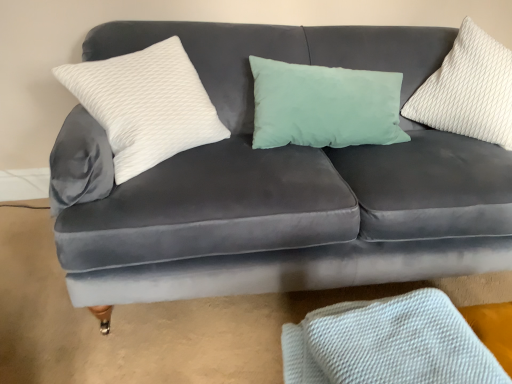
Question: Should I look upward or downward to see white textured fabric at lower right?

Choices:
 (A) down
 (B) up

Answer: (A)

Question: Can you confirm if white textured fabric at lower right is taller than white textured pillow at upper right, the first pillow from the right?

Choices:
 (A) no
 (B) yes

Answer: (A)

Question: Would you say white textured fabric at lower right is outside white textured pillow at upper right, the first pillow from the right?

Choices:
 (A) yes
 (B) no

Answer: (A)

Question: Can you confirm if white textured fabric at lower right is smaller than white textured pillow at upper right, the first pillow from the right?

Choices:
 (A) yes
 (B) no

Answer: (A)

Question: Can you confirm if white textured fabric at lower right is bigger than white textured pillow at upper right, the second pillow from the left?

Choices:
 (A) no
 (B) yes

Answer: (A)

Question: Is white textured fabric at lower right to the right of white textured pillow at upper right, the first pillow from the right, from the viewer's perspective?

Choices:
 (A) yes
 (B) no

Answer: (B)

Question: Is the depth of white textured fabric at lower right less than that of white textured pillow at upper right, the second pillow from the left?

Choices:
 (A) yes
 (B) no

Answer: (A)

Question: Is white textured fabric at lower right surrounded by white textured pillow at left, the 2th pillow positioned from the right?

Choices:
 (A) yes
 (B) no

Answer: (B)

Question: Is white textured pillow at left, the 1th pillow positioned from the left, thinner than white textured fabric at lower right?

Choices:
 (A) no
 (B) yes

Answer: (B)

Question: Would you consider white textured pillow at left, the 1th pillow positioned from the left, to be distant from white textured fabric at lower right?

Choices:
 (A) no
 (B) yes

Answer: (A)

Question: From a real-world perspective, is white textured pillow at left, the 2th pillow positioned from the right, on white textured fabric at lower right?

Choices:
 (A) yes
 (B) no

Answer: (A)

Question: Is white textured pillow at left, the 1th pillow positioned from the left, facing away from white textured fabric at lower right?

Choices:
 (A) no
 (B) yes

Answer: (A)

Question: Considering the relative sizes of white textured pillow at left, the 2th pillow positioned from the right, and white textured fabric at lower right in the image provided, is white textured pillow at left, the 2th pillow positioned from the right, wider than white textured fabric at lower right?

Choices:
 (A) yes
 (B) no

Answer: (B)

Question: Is white textured pillow at left, the 1th pillow positioned from the left, outside white textured pillow at upper right, the second pillow from the left?

Choices:
 (A) yes
 (B) no

Answer: (A)